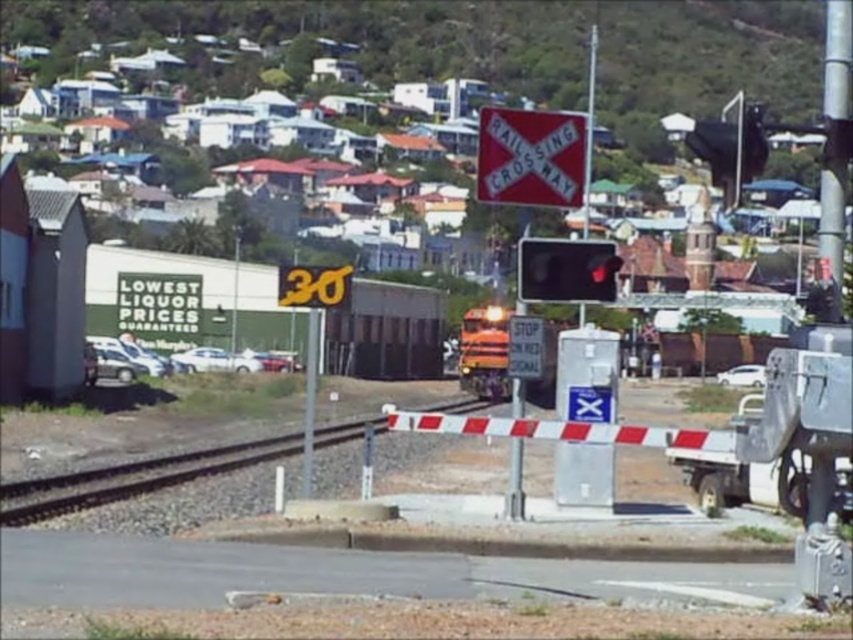
You are a driver approaching the railway crossing and see the red plastic railroad crossing sign at center and the metallic traffic light at center. Which object appears larger to you?

The metallic traffic light at center appears larger than the red plastic railroad crossing sign at center because the red plastic railroad crossing sign at center is smaller than metallic traffic light at center.

You are driving a car and see the red plastic railroad crossing sign at center and the metallic traffic light at center. Which object is closer to you?

The red plastic railroad crossing sign at center is closer to you because the metallic traffic light at center is behind it.